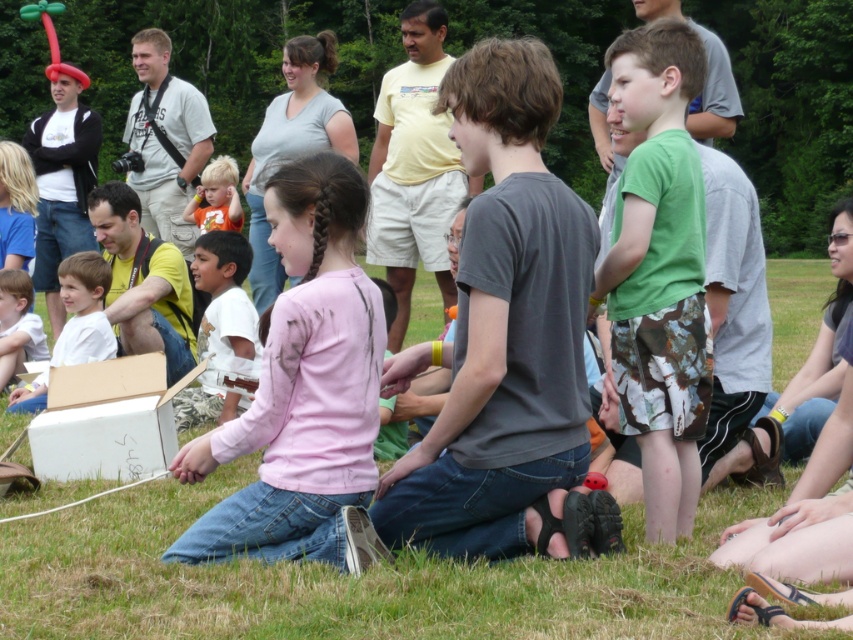
Which is in front, point (257, 413) or point (216, 200)?

Point (257, 413) is in front.

Can you confirm if pink matte shirt at center is positioned above orange t-shirt at center?

Incorrect, pink matte shirt at center is not positioned above orange t-shirt at center.

Is point (335, 401) positioned in front of point (221, 189)?

Yes, point (335, 401) is closer to viewer.

This screenshot has height=640, width=853. I want to click on pink matte shirt at center, so [303, 392].

Between pink matte shirt at center and white cotton shirt at center, which one appears on the right side from the viewer's perspective?

pink matte shirt at center

Find the location of a particular element. Image resolution: width=853 pixels, height=640 pixels. pink matte shirt at center is located at coordinates (303, 392).

Measure the distance between point (341, 420) and camera.

5.20 meters

Locate an element on the screen. This screenshot has width=853, height=640. pink matte shirt at center is located at coordinates (303, 392).

Which is below, pink matte shirt at center or light brown wooden chair at lower left?

light brown wooden chair at lower left

Does pink matte shirt at center appear over light brown wooden chair at lower left?

Indeed, pink matte shirt at center is positioned over light brown wooden chair at lower left.

Between point (289, 202) and point (0, 387), which one is positioned behind?

Point (0, 387)

The width and height of the screenshot is (853, 640). I want to click on pink matte shirt at center, so click(303, 392).